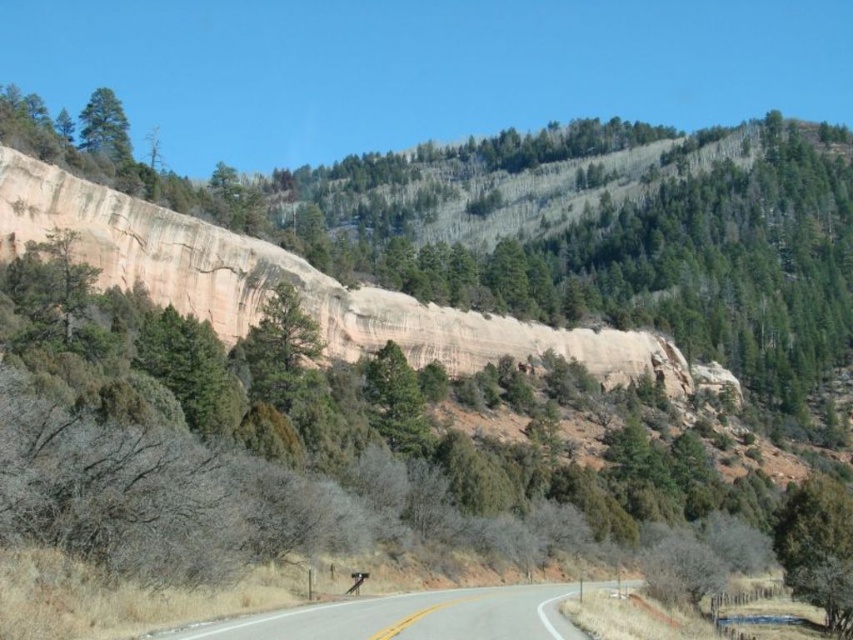
You are a hiker standing at the start of the smooth asphalt road at center. You notice the green matte tree at upper left in the distance. Which object appears taller from your vantage point?

The green matte tree at upper left appears taller than the smooth asphalt road at center from your vantage point because the smooth asphalt road at center has a lesser height compared to green matte tree at upper left.

You are standing at the starting point of the road and want to reach a destination located at point (x=86, y=102). There is an obstacle at point (x=506, y=593) blocking your path. Can you safely navigate around the obstacle to reach your destination?

Point (x=506, y=593) is closer to the camera than point (x=86, y=102), so the obstacle at point (x=506, y=593) is between you and your destination. You will need to navigate around it to reach point (x=86, y=102).